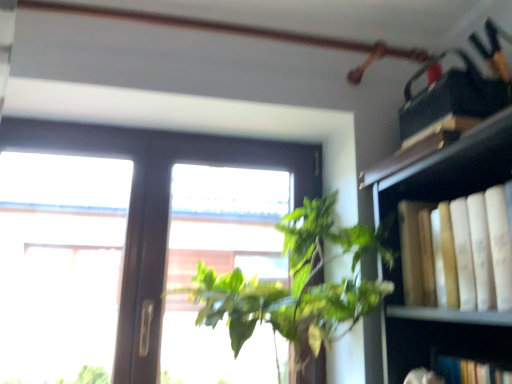
Question: Could you tell me if transparent glass window at center is turned towards green leafy plant at center?

Choices:
 (A) no
 (B) yes

Answer: (B)

Question: Is the surface of transparent glass window at center in direct contact with green leafy plant at center?

Choices:
 (A) yes
 (B) no

Answer: (B)

Question: Would you say transparent glass window at center contains green leafy plant at center?

Choices:
 (A) no
 (B) yes

Answer: (A)

Question: Is transparent glass window at center wider than green leafy plant at center?

Choices:
 (A) no
 (B) yes

Answer: (A)

Question: Considering the relative sizes of transparent glass window at center and green leafy plant at center in the image provided, is transparent glass window at center taller than green leafy plant at center?

Choices:
 (A) yes
 (B) no

Answer: (A)

Question: Is transparent glass window at center outside green leafy plant at center?

Choices:
 (A) no
 (B) yes

Answer: (B)

Question: Is green leafy plant at center facing towards transparent glass window at center?

Choices:
 (A) yes
 (B) no

Answer: (B)

Question: Does green leafy plant at center have a larger size compared to transparent glass window at center?

Choices:
 (A) yes
 (B) no

Answer: (A)

Question: Does green leafy plant at center appear on the left side of transparent glass window at center?

Choices:
 (A) yes
 (B) no

Answer: (B)

Question: From a real-world perspective, is green leafy plant at center physically above transparent glass window at center?

Choices:
 (A) yes
 (B) no

Answer: (B)

Question: Is green leafy plant at center positioned before transparent glass window at center?

Choices:
 (A) no
 (B) yes

Answer: (B)

Question: Is the position of green leafy plant at center more distant than that of transparent glass window at center?

Choices:
 (A) yes
 (B) no

Answer: (B)

Question: Can you confirm if transparent glass window at center is thinner than yellow paper book at right?

Choices:
 (A) no
 (B) yes

Answer: (B)